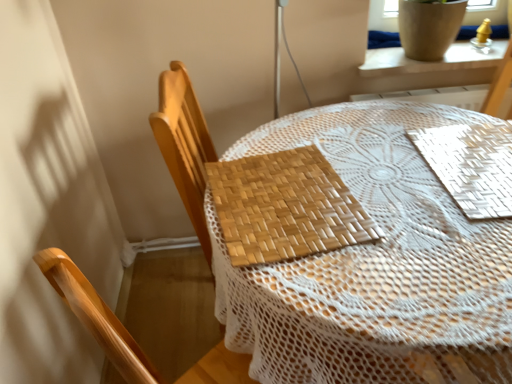
Find the location of a particular element. This screenshot has height=384, width=512. empty space that is in between woven wood placemat at center, the 2th mat positioned from the right, and white woven mat at upper right, arranged as the second mat when viewed from the left is located at coordinates (395, 183).